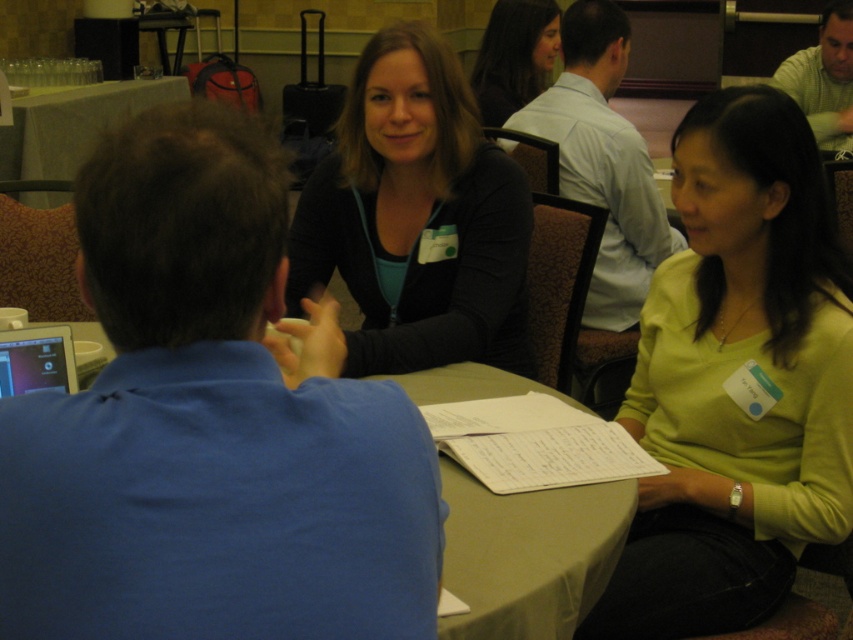
Question: Can you confirm if white fabric table at upper left is positioned above light green shirt at upper right?

Choices:
 (A) yes
 (B) no

Answer: (B)

Question: Which point is farther from the camera taking this photo?

Choices:
 (A) (461, 561)
 (B) (788, 84)

Answer: (B)

Question: Does light blue shirt at center have a lesser width compared to white fabric table at upper left?

Choices:
 (A) yes
 (B) no

Answer: (B)

Question: Which object appears closest to the camera in this image?

Choices:
 (A) white fabric table at upper left
 (B) matte yellow shirt at right

Answer: (B)

Question: Which of the following is the farthest from the observer?

Choices:
 (A) (367, 364)
 (B) (480, 88)

Answer: (B)

Question: Does smooth beige table at center have a larger size compared to light green shirt at upper right?

Choices:
 (A) no
 (B) yes

Answer: (A)